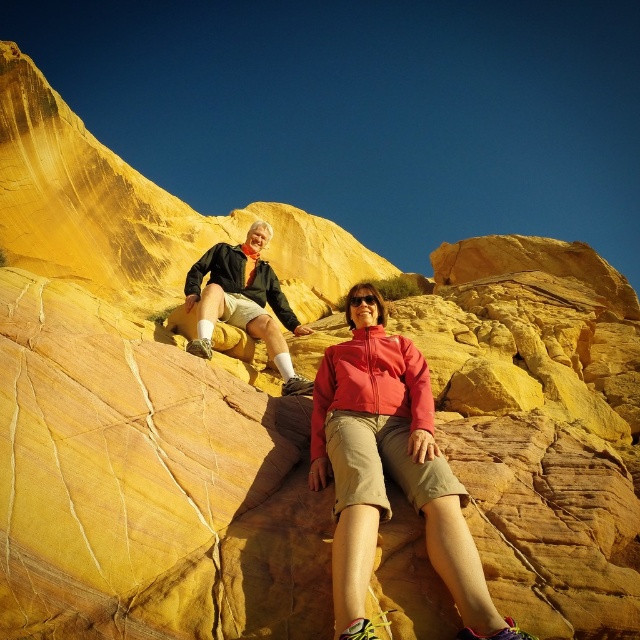
You are a photographer trying to capture both the matte pink jacket at center and the matte black jacket at upper left in the same frame. Based on their sizes, which jacket will appear closer to the camera?

The matte pink jacket at center appears larger than the matte black jacket at upper left, so it will look closer to the camera.

You are a photographer trying to capture both the matte pink jacket at center and the matte black jacket at upper left in the same frame. Based on their positions, which jacket is closer to the camera?

The matte pink jacket at center is closer to the camera because it is positioned in front of the matte black jacket at upper left.